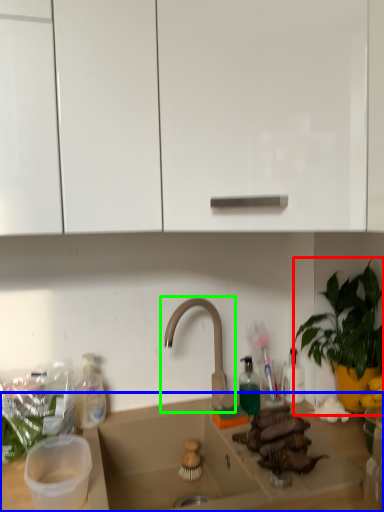
Question: Estimate the real-world distances between objects in this image. Which object is farther from houseplant (highlighted by a red box), countertop (highlighted by a blue box) or tap (highlighted by a green box)?

Choices:
 (A) countertop
 (B) tap

Answer: (A)